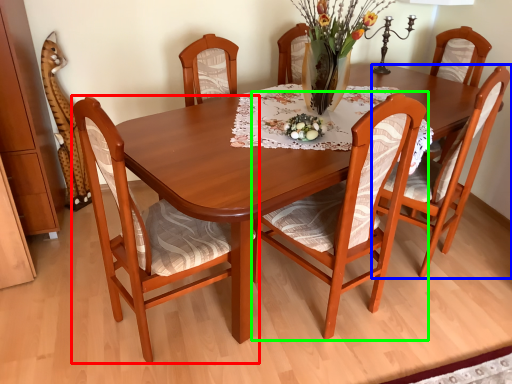
Question: Based on their relative distances, which object is nearer to chair (highlighted by a red box)? Choose from chair (highlighted by a blue box) and chair (highlighted by a green box).

Choices:
 (A) chair
 (B) chair

Answer: (B)